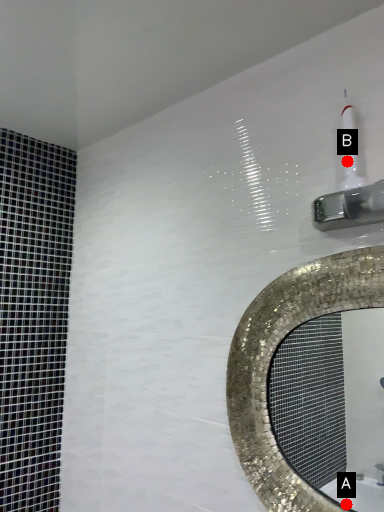
Question: Two points are circled on the image, labeled by A and B beside each circle. Among these points, which one is farthest from the camera?

Choices:
 (A) A is further
 (B) B is further

Answer: (A)